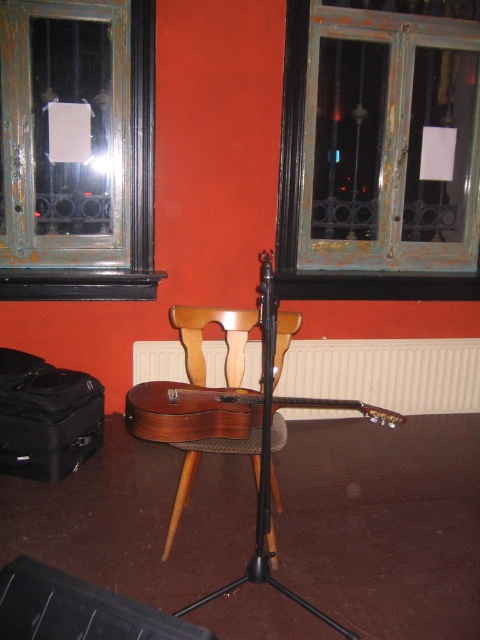
Does white textured radiator at center appear on the left side of greenish wooden window at upper center?

Correct, you'll find white textured radiator at center to the left of greenish wooden window at upper center.

Between point (291, 356) and point (295, 234), which one is positioned in front?

Point (295, 234)

Is point (387, 339) closer to camera compared to point (287, 145)?

No, it is behind (287, 145).

Locate an element on the screen. white textured radiator at center is located at coordinates (386, 372).

Is greenish wooden window at upper center smaller than black matte tripod at center?

Actually, greenish wooden window at upper center might be larger than black matte tripod at center.

Where is `greenish wooden window at upper center`? The image size is (480, 640). greenish wooden window at upper center is located at coordinates (299, 205).

Is greenish wooden window at upper center positioned behind wooden chair at center?

Yes.

Who is more forward, (x=288, y=100) or (x=187, y=316)?

Point (x=187, y=316)

Where is `greenish wooden window at upper center`? The width and height of the screenshot is (480, 640). greenish wooden window at upper center is located at coordinates (299, 205).